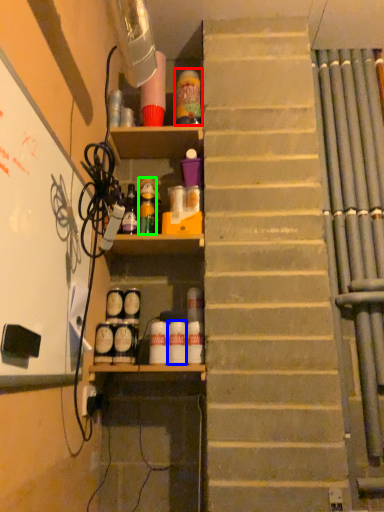
Question: Estimate the real-world distances between objects in this image. Which object is closer to bottle (highlighted by a red box), bottle (highlighted by a blue box) or bottle (highlighted by a green box)?

Choices:
 (A) bottle
 (B) bottle

Answer: (B)